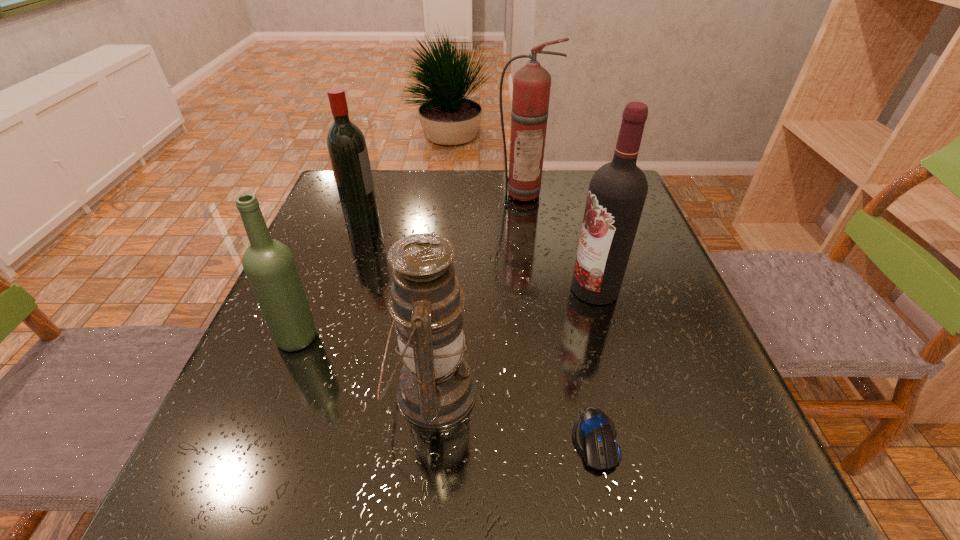
Where is `free spot located 0.250m on the label of the tallest wine bottle`? This screenshot has width=960, height=540. free spot located 0.250m on the label of the tallest wine bottle is located at coordinates (456, 289).

This screenshot has width=960, height=540. Find the location of `vacant area situated on the label of the farthest wine bottle`. vacant area situated on the label of the farthest wine bottle is located at coordinates (505, 219).

You are a GUI agent. You are given a task and a screenshot of the screen. Output one action in this format:
    pyautogui.click(x=<x>, y=<y>)
    Task: Click on the vacant space located 0.370m on the right of the third object from left to right
    The image size is (960, 540).
    Given the screenshot: What is the action you would take?
    pyautogui.click(x=690, y=392)

Locate an element on the screen. The width and height of the screenshot is (960, 540). vacant space located 0.140m on the right of the nearest wine bottle is located at coordinates (391, 337).

At what (x,y) coordinates should I click in order to perform the action: click on fire extinguisher positioned at the far edge. Please return your answer as a coordinate pair (x, y). Image resolution: width=960 pixels, height=540 pixels. Looking at the image, I should click on (531, 85).

Image resolution: width=960 pixels, height=540 pixels. I want to click on wine bottle that is at the far edge, so click(347, 148).

At what (x,y) coordinates should I click in order to perform the action: click on object present at the near edge. Please return your answer as a coordinate pair (x, y). Looking at the image, I should click on (594, 434).

Where is `object situated at the right edge`? The width and height of the screenshot is (960, 540). object situated at the right edge is located at coordinates (617, 192).

Identify the location of object positioned at the far left corner. tap(347, 148).

This screenshot has height=540, width=960. In order to click on free spot at the far edge of the desktop in this screenshot , I will do `click(501, 189)`.